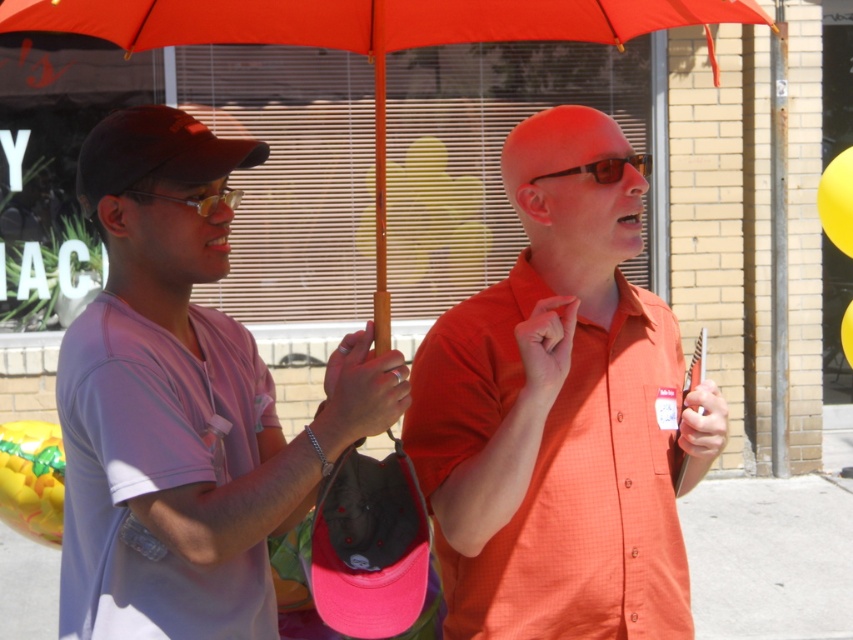
Which is below, yellow matte balloon at upper right or matte yellow goggles at center?

matte yellow goggles at center is lower down.

Does yellow matte balloon at upper right appear on the right side of matte yellow goggles at center?

Indeed, yellow matte balloon at upper right is positioned on the right side of matte yellow goggles at center.

The width and height of the screenshot is (853, 640). What are the coordinates of `yellow matte balloon at upper right` in the screenshot? It's located at (837, 200).

Which is more to the right, orange matte shirt at center or yellow rubber balloon at lower left?

orange matte shirt at center is more to the right.

Looking at this image, can you confirm if orange matte shirt at center is thinner than yellow rubber balloon at lower left?

No.

Which is behind, point (509, 417) or point (4, 458)?

Point (4, 458)

Find the location of a particular element. This screenshot has width=853, height=640. orange matte shirt at center is located at coordinates (560, 413).

Does yellow matte balloon at upper right have a lesser width compared to matte black sunglasses at center?

Correct, yellow matte balloon at upper right's width is less than matte black sunglasses at center's.

Does yellow matte balloon at upper right appear on the right side of matte black sunglasses at center?

Indeed, yellow matte balloon at upper right is positioned on the right side of matte black sunglasses at center.

At what (x,y) coordinates should I click in order to perform the action: click on yellow matte balloon at upper right. Please return your answer as a coordinate pair (x, y). The image size is (853, 640). Looking at the image, I should click on (837, 200).

The width and height of the screenshot is (853, 640). Identify the location of yellow matte balloon at upper right. (837, 200).